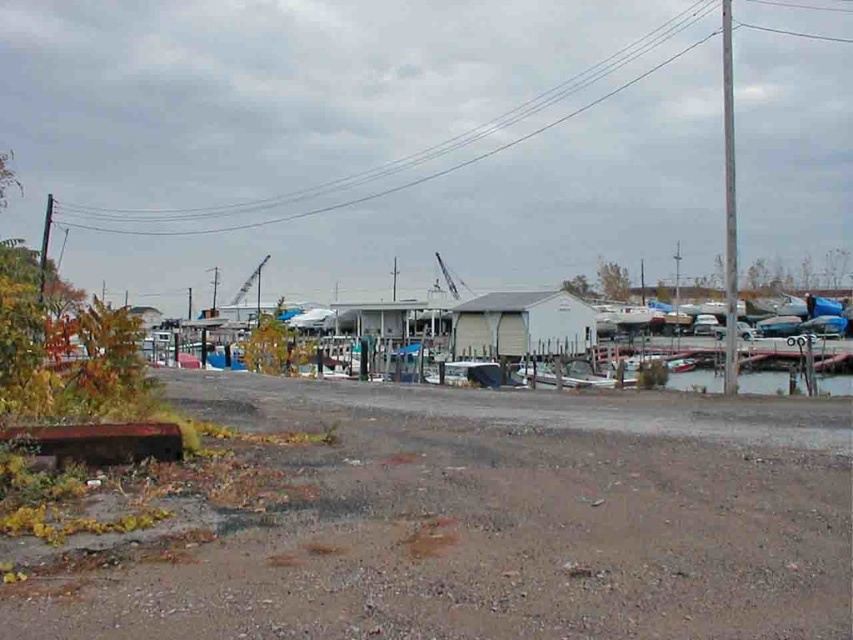
Question: Among these objects, which one is nearest to the camera?

Choices:
 (A) white matte boat at center
 (B) dull brown dirt track at lower left

Answer: (B)

Question: Does dull brown dirt track at lower left appear on the left side of white matte boat at center?

Choices:
 (A) yes
 (B) no

Answer: (A)

Question: Is dull brown dirt track at lower left above clear water at lower right?

Choices:
 (A) no
 (B) yes

Answer: (B)

Question: Estimate the real-world distances between objects in this image. Which object is closer to the clear water at lower right?

Choices:
 (A) dull brown dirt track at lower left
 (B) white matte boat at center

Answer: (B)

Question: Considering the real-world distances, which object is closest to the clear water at lower right?

Choices:
 (A) dull brown dirt track at lower left
 (B) white matte boat at center

Answer: (B)

Question: Can you confirm if dull brown dirt track at lower left is smaller than white matte boat at center?

Choices:
 (A) yes
 (B) no

Answer: (A)